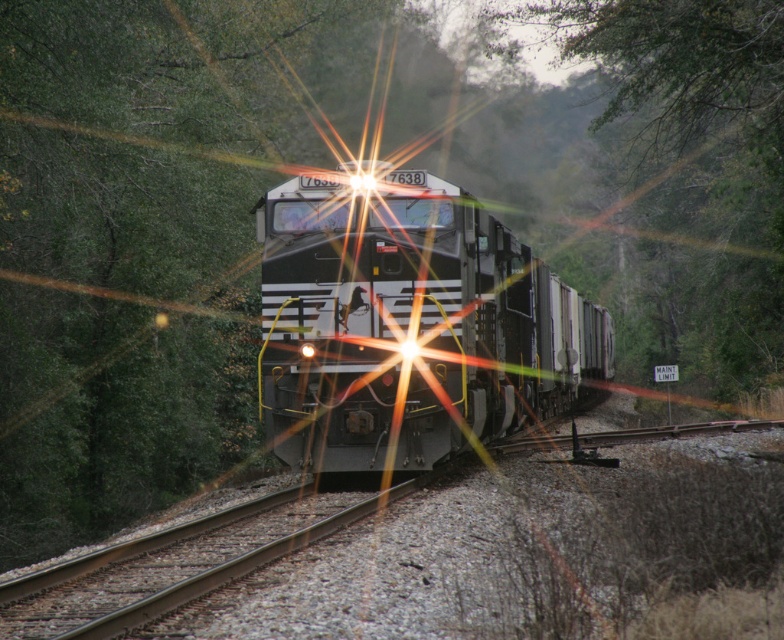
You are a passenger on the train and looking out the window. You see a point marked at coordinates (409, 323). What object is this point located on?

The point at coordinates (409, 323) is located on the metallic freight train at center.

You are a photographer trying to capture the metallic freight train at center in your shot. Based on its position, where should you aim your camera to ensure the train is centered in the frame?

To center the metallic freight train at center in your frame, aim your camera at the coordinates point (409, 323) as this is the 2D location of the metallic freight train at center.

You are standing on the railway tracks and see the metallic freight train at center approaching you. If the train is moving at 30 km per hour, how much time do you have before it reaches you?

The metallic freight train at center is 15.42 meters away from you. At 30 km per hour, the train travels 8.33 meters per second. Dividing 15.42 by 8.33 gives approximately 1.85 seconds. Therefore, you have about 1.85 seconds before the train reaches you.